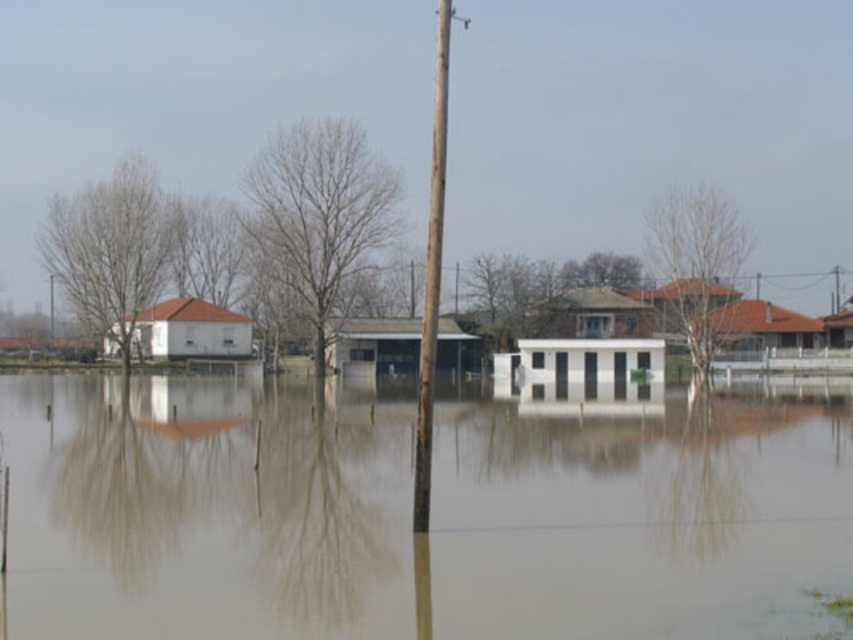
You are a drone operator assessing flood damage. You need to locate the bare wood tree at left in the image. What are its coordinates?

The bare wood tree at left is located at coordinates point (109, 250).

You are a rescue worker trying to navigate through the flooded area. You see a bare wood tree at center and a brown wooden telegraph pole at center. Which object is closer to the water surface?

The brown wooden telegraph pole at center is higher than the bare wood tree at center, so the bare wood tree at center is closer to the water surface.

Consider the image. You are a rescue worker assessing the flooded area. You see the brown murky water at center and the bare wood tree at left. Which of these two occupies more space in the image?

The bare wood tree at left occupies more space than the brown murky water at center.